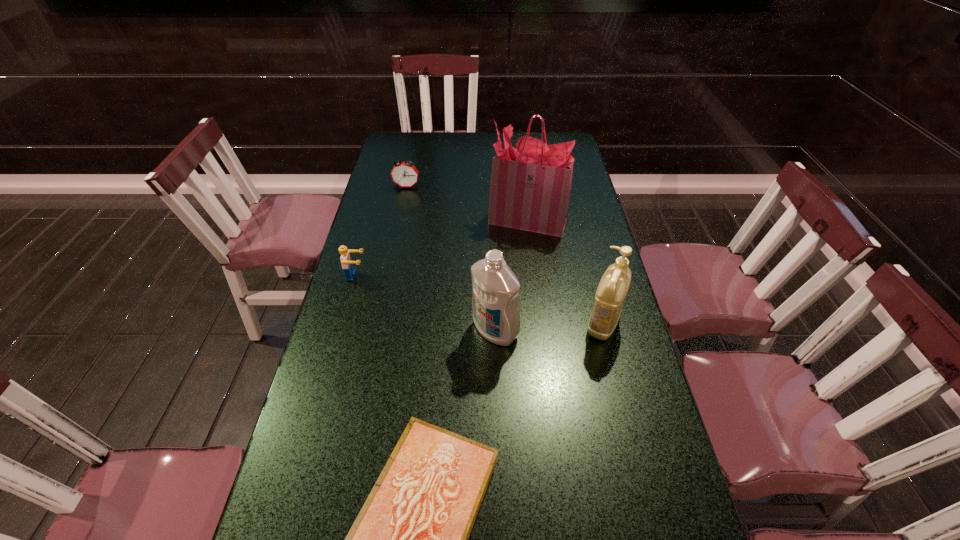
Find the location of a particular element. vacant region located on the right of the second tallest object is located at coordinates (601, 330).

The image size is (960, 540). What are the coordinates of `vacant space positioned 0.280m on the front of the shorter detergent` in the screenshot? It's located at (635, 452).

Locate an element on the screen. Image resolution: width=960 pixels, height=540 pixels. free point located 0.210m on the clock face of the alarm clock is located at coordinates (398, 225).

Where is `vacant space located on the face of the Lego`? vacant space located on the face of the Lego is located at coordinates (446, 276).

Where is `alarm clock at the left edge`? alarm clock at the left edge is located at coordinates (404, 174).

I want to click on Lego that is at the left edge, so click(x=347, y=264).

This screenshot has height=540, width=960. Identify the location of shopping bag at the right edge. (530, 189).

You are a GUI agent. You are given a task and a screenshot of the screen. Output one action in this format:
    pyautogui.click(x=<x>, y=<y>)
    Task: Click on the detergent at the right edge
    The image size is (960, 540).
    Given the screenshot: What is the action you would take?
    pyautogui.click(x=614, y=284)

Locate an element on the screen. vacant space at the far edge is located at coordinates (426, 143).

Identify the location of vacant space at the left edge of the desktop. The image size is (960, 540). (326, 524).